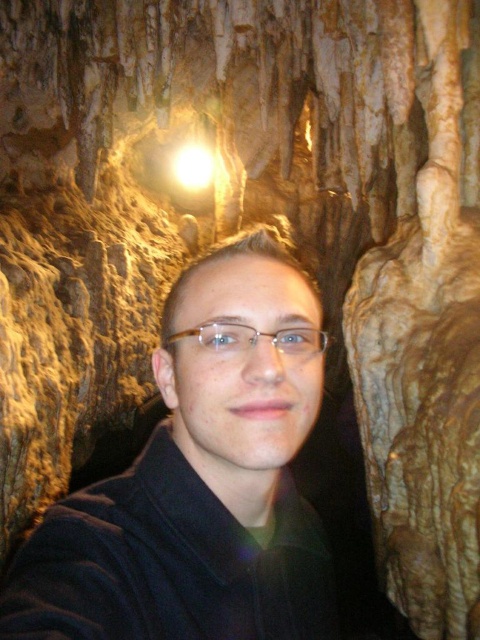
Question: Among these objects, which one is farthest from the camera?

Choices:
 (A) black matte jacket at center
 (B) clear plastic glasses at center

Answer: (B)

Question: Which of the following is the closest to the observer?

Choices:
 (A) clear plastic glasses at center
 (B) black matte jacket at center

Answer: (B)

Question: Does black matte jacket at center appear on the left side of clear plastic glasses at center?

Choices:
 (A) yes
 (B) no

Answer: (A)

Question: Is black matte jacket at center bigger than clear plastic glasses at center?

Choices:
 (A) yes
 (B) no

Answer: (A)

Question: Can you confirm if black matte jacket at center is positioned to the right of clear plastic glasses at center?

Choices:
 (A) yes
 (B) no

Answer: (B)